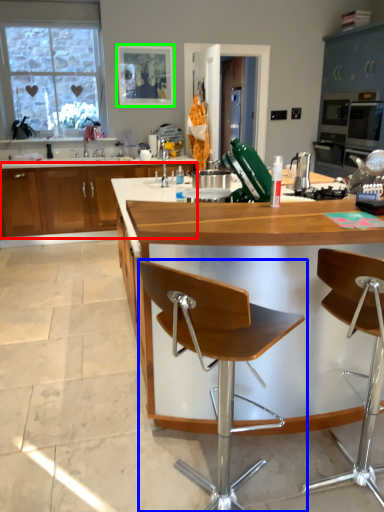
Question: Based on their relative distances, which object is farther from cabinetry (highlighted by a red box)? Choose from chair (highlighted by a blue box) and picture frame (highlighted by a green box).

Choices:
 (A) chair
 (B) picture frame

Answer: (A)